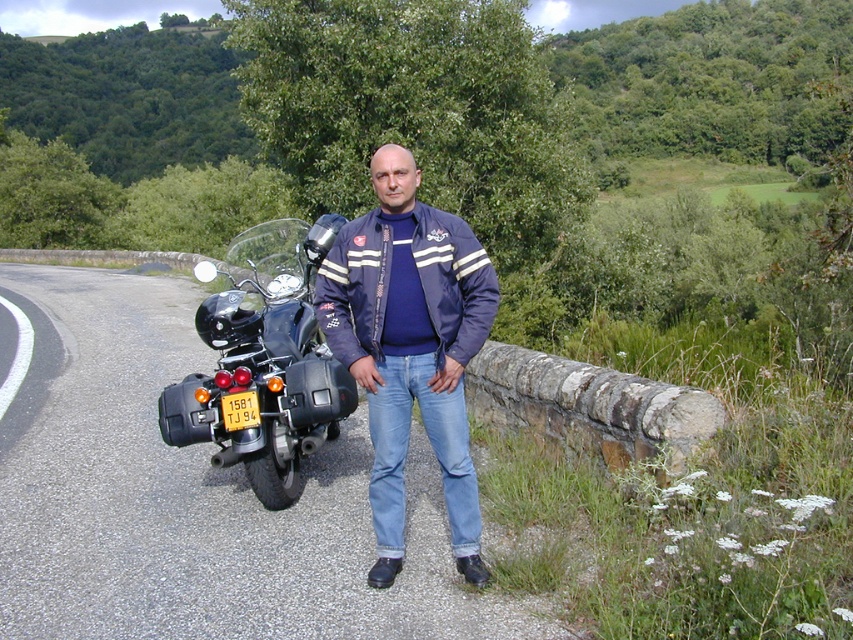
You are a pedestrian walking on the asphalt road at center. You want to reach the navy blue jacket at center. Is the jacket above or below the road?

The asphalt road at center is below the navy blue jacket at center, so the jacket is above the road.

You are a GPS navigator and need to determine the coordinates of the asphalt road at center. What are its coordinates?

The asphalt road at center is located at coordinates point (196,499).

You are a photographer trying to capture the man in the navy blue jacket at center. The camera you are using has a focus point at coordinate (410, 346). Will this focus point land on the man?

Yes, the focus point at coordinate (410, 346) corresponds to the navy blue jacket at center, so it will land on the man.